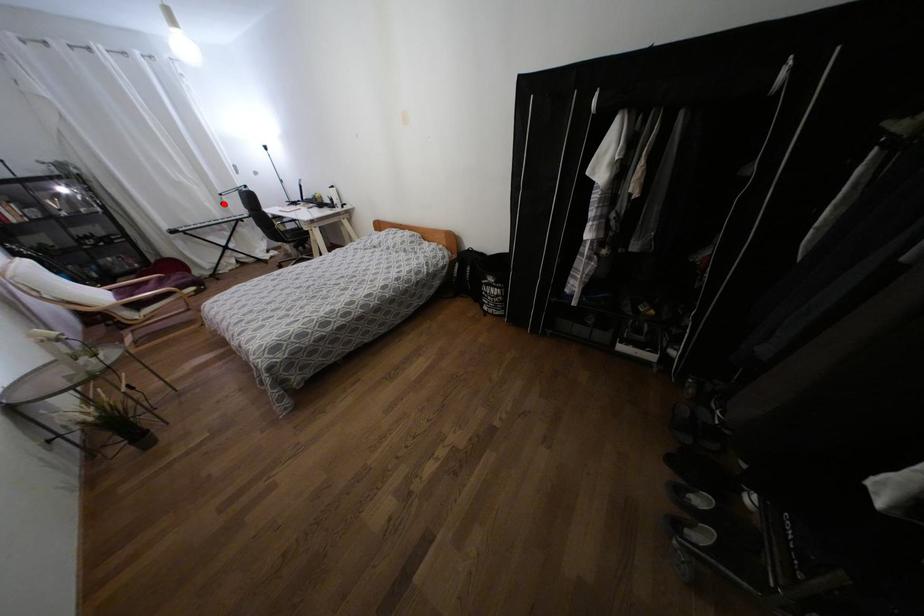
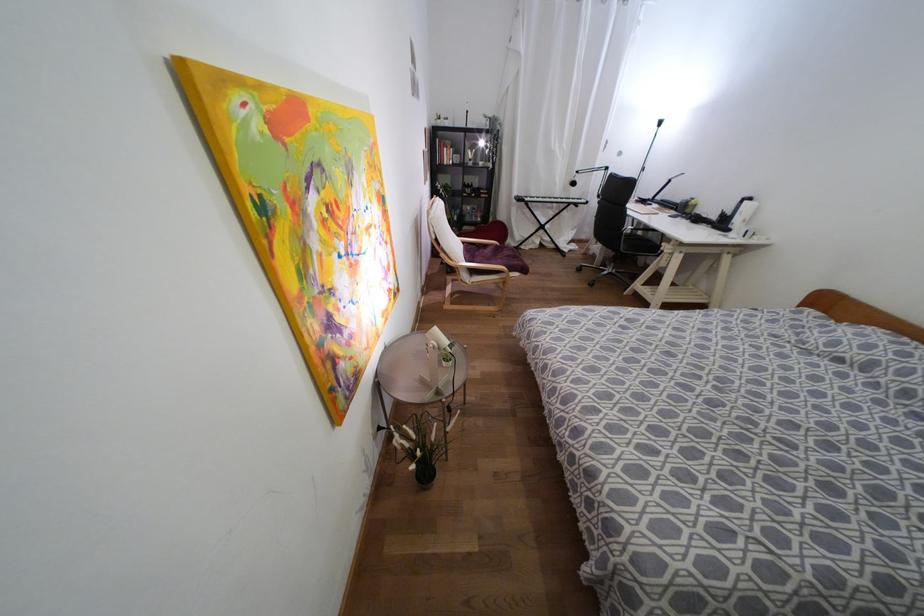
Find the pixel in the second image that matches the highlighted location in the first image.

(573, 183)